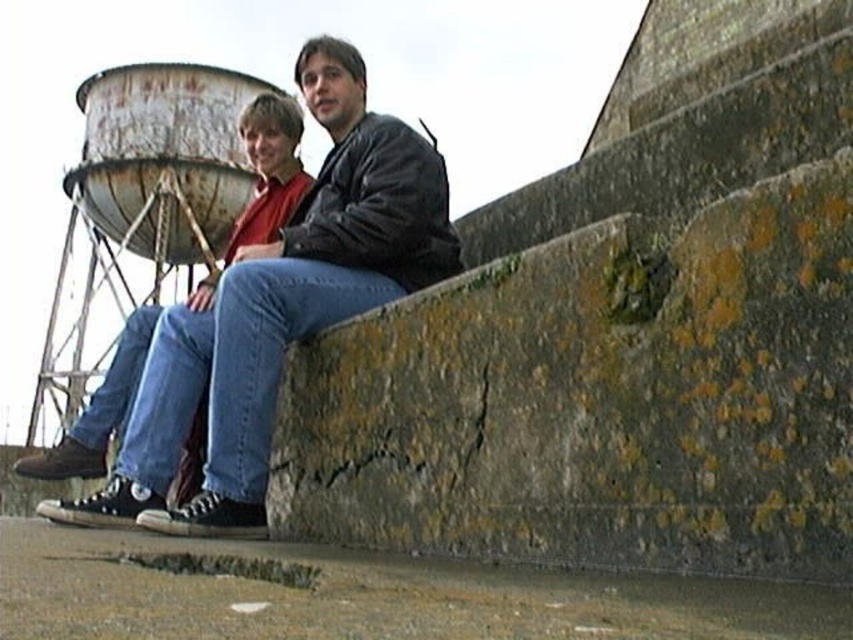
You are a photographer trying to capture a clear shot of the denim jeans at center without the rusty metal water tower at upper left blocking it. Based on their positions, can you adjust your camera angle to achieve this?

The denim jeans at center is in front of the rusty metal water tower at upper left, so adjusting the camera angle to focus on the denim jeans at center while moving the camera position to the side or lower might allow you to capture the jeans without the water tower blocking the view.

From the picture: You are a photographer trying to capture both the denim jeans at center and the rusty metal water tower at upper left in a single frame. Which object will appear smaller in the photo?

The denim jeans at center will appear smaller in the photo because it occupies less space than the rusty metal water tower at upper left.